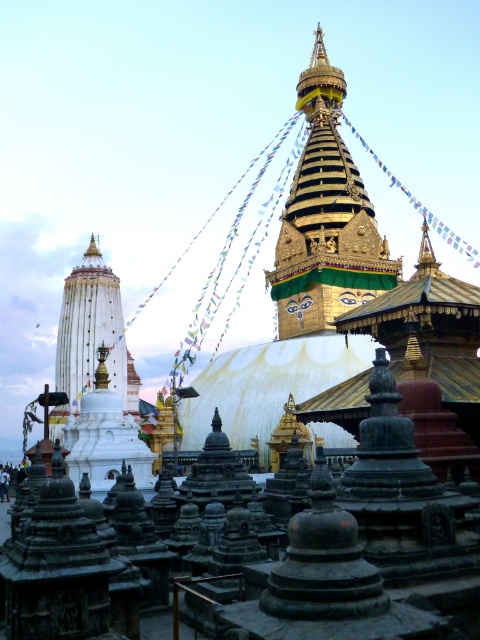
Does gold/gilded stupa at center have a greater width compared to white marble stupa at left?

Yes, gold/gilded stupa at center is wider than white marble stupa at left.

Which is above, gold/gilded stupa at center or white marble stupa at left?

Positioned higher is gold/gilded stupa at center.

Where is `gold/gilded stupa at center`? gold/gilded stupa at center is located at coordinates (325, 218).